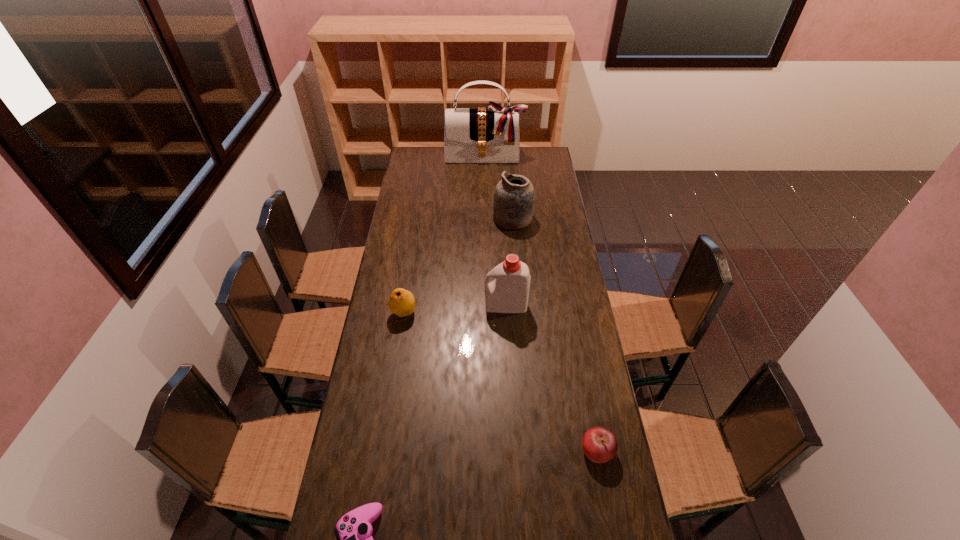
Where is `blank area in the image that satisfies the following two spatial constraints: 1. on the front-facing side of the satchel; 2. on the left side of the second nearest object`? This screenshot has width=960, height=540. blank area in the image that satisfies the following two spatial constraints: 1. on the front-facing side of the satchel; 2. on the left side of the second nearest object is located at coordinates (488, 450).

This screenshot has width=960, height=540. What are the coordinates of `free region that satisfies the following two spatial constraints: 1. on the front side of the second farthest object; 2. on the right side of the rightmost object` in the screenshot? It's located at (x=532, y=450).